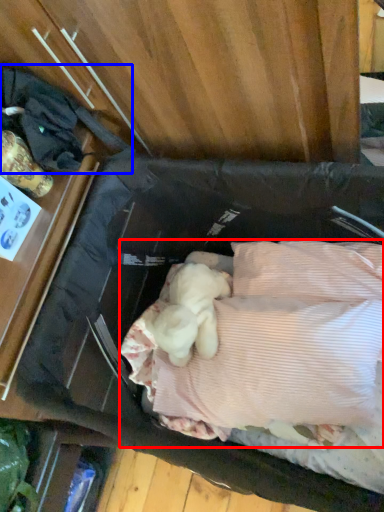
Question: Which of the following is the farthest to the observer, wide (highlighted by a red box) or clothing (highlighted by a blue box)?

Choices:
 (A) wide
 (B) clothing

Answer: (A)